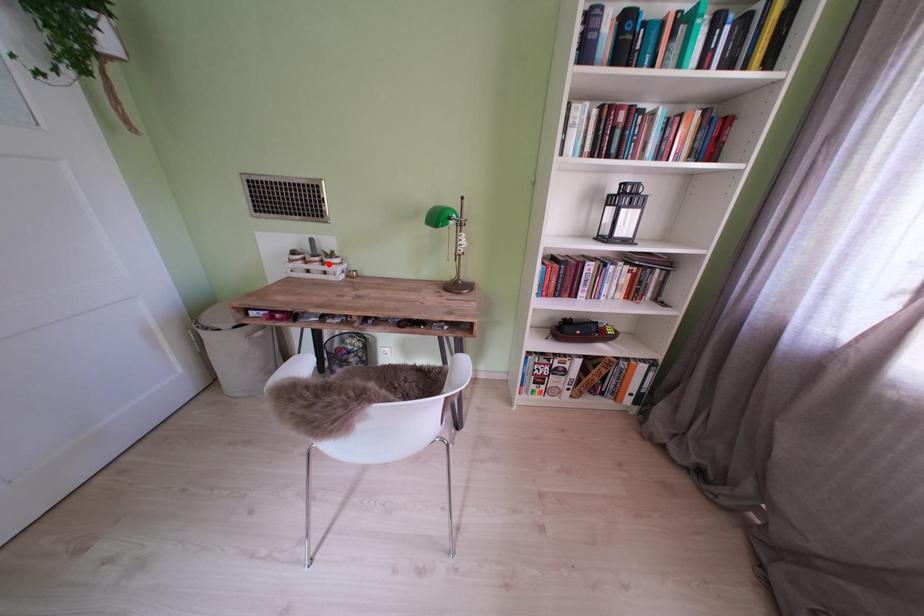
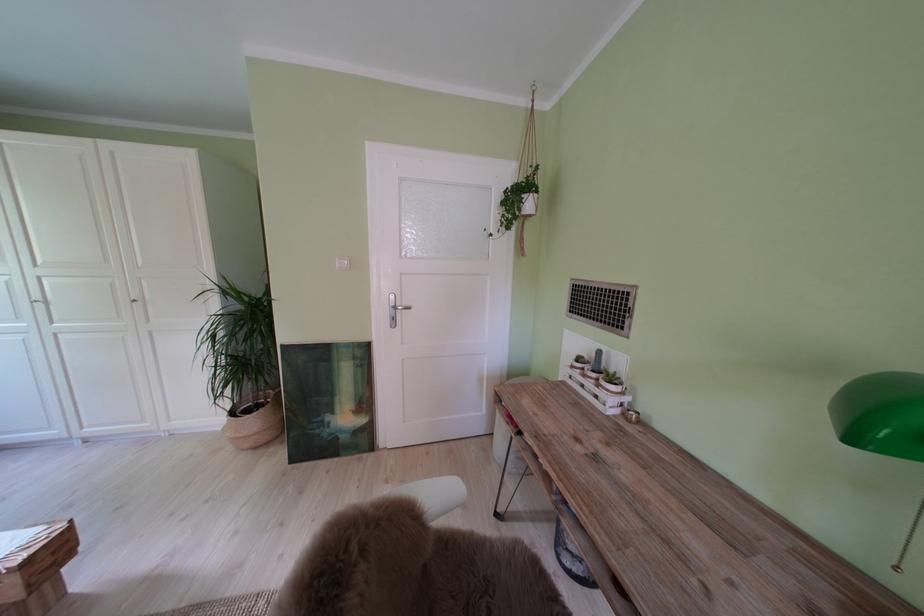
Find the pixel in the second image that matches the highlighted location in the first image.

(604, 381)